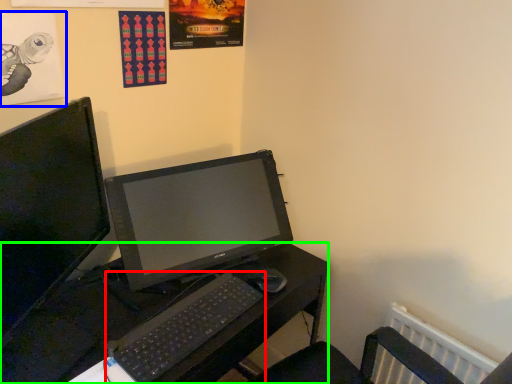
Question: Considering the real-world distances, which object is closest to computer keyboard (highlighted by a red box)? poster page (highlighted by a blue box) or desk (highlighted by a green box).

Choices:
 (A) poster page
 (B) desk

Answer: (B)